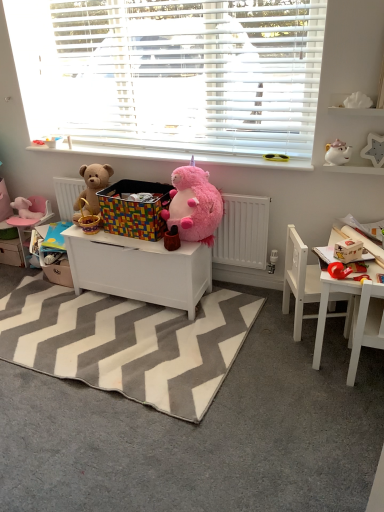
What are the coordinates of `free spot in front of brushed metal drawer at lower left` in the screenshot? It's located at pos(9,274).